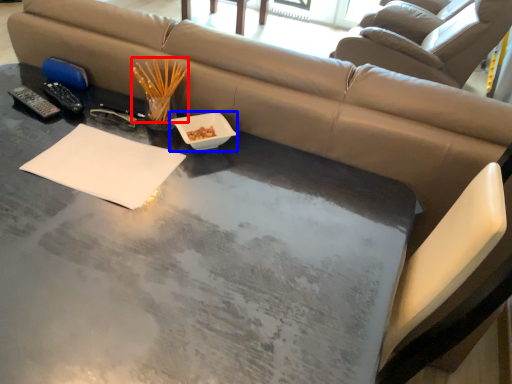
Question: Which point is closer to the camera, chopstick (highlighted by a red box) or bowl (highlighted by a blue box)?

Choices:
 (A) chopstick
 (B) bowl

Answer: (B)